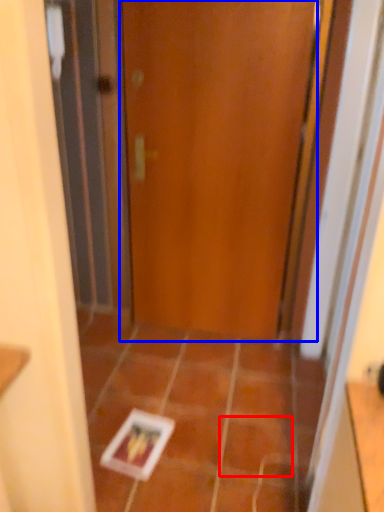
Question: Which object appears farthest to the camera in this image, ceramic tile (highlighted by a red box) or door (highlighted by a blue box)?

Choices:
 (A) ceramic tile
 (B) door

Answer: (B)